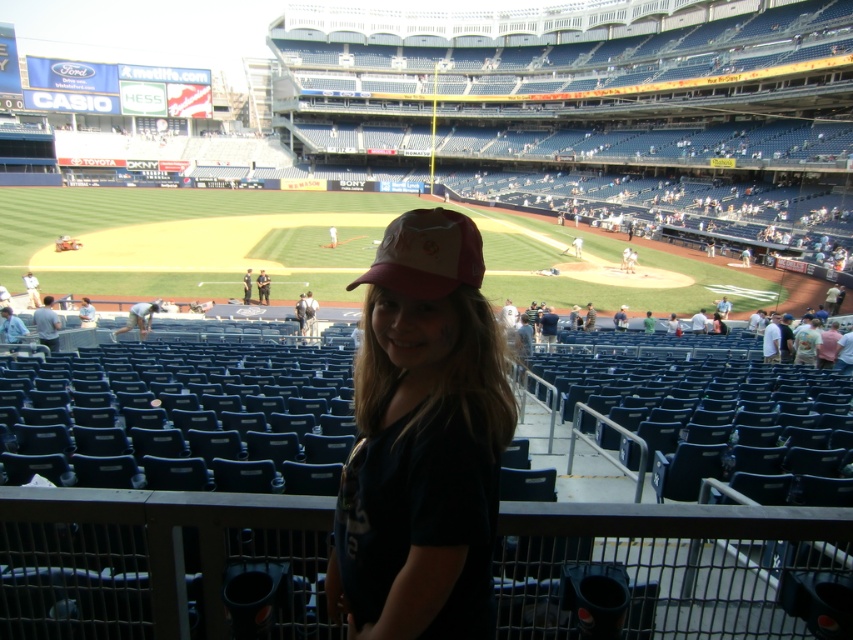
You are a photographer standing at the edge of the baseball field. You want to take a photo of two specific points in the scene. The first point is at coordinates point (403, 369) and the second is at point (430, 230). Which point is closer to you?

Point (403, 369) is closer to you because it is further to the viewer than point (430, 230).